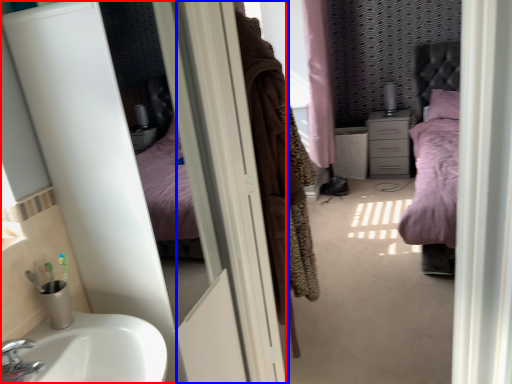
Question: Which point is closer to the camera, screen door (highlighted by a red box) or screen door (highlighted by a blue box)?

Choices:
 (A) screen door
 (B) screen door

Answer: (A)